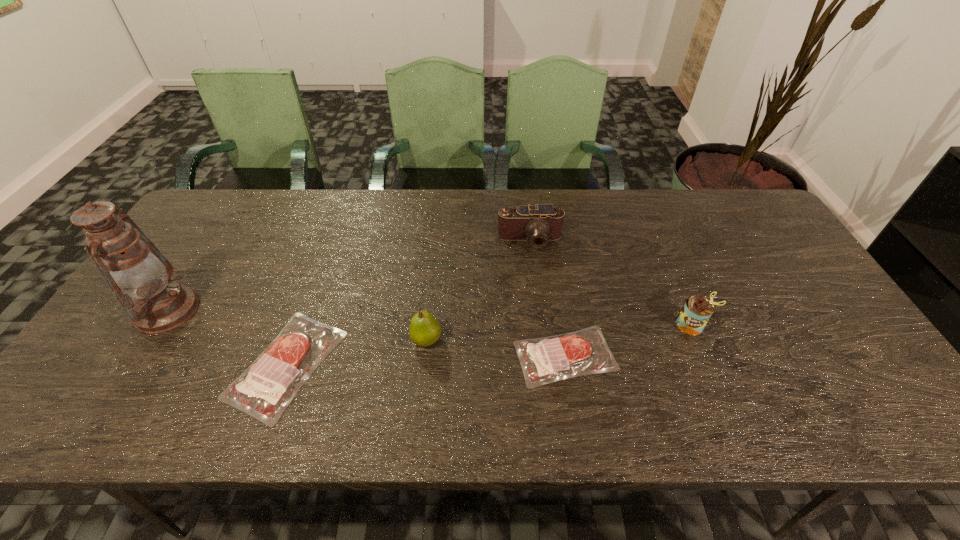
At what (x,y) coordinates should I click in order to perform the action: click on blank region between the fourth object from right to left and the camera. Please return your answer as a coordinate pair (x, y). The width and height of the screenshot is (960, 540). Looking at the image, I should click on (478, 291).

At what (x,y) coordinates should I click in order to perform the action: click on unoccupied position between the shorter steak and the pear. Please return your answer as a coordinate pair (x, y). Image resolution: width=960 pixels, height=540 pixels. Looking at the image, I should click on (495, 348).

Locate which object ranks third in proximity to the camera. Please provide its 2D coordinates. Your answer should be formatted as a tuple, i.e. [(x, y)], where the tuple contains the x and y coordinates of a point satisfying the conditions above.

[(697, 310)]

You are a GUI agent. You are given a task and a screenshot of the screen. Output one action in this format:
    pyautogui.click(x=<x>, y=<y>)
    Task: Click on the object identified as the closest to the tallest object
    This screenshot has width=960, height=540.
    Given the screenshot: What is the action you would take?
    pyautogui.click(x=264, y=390)

Locate an element on the screen. vacant area that satisfies the following two spatial constraints: 1. on the back side of the fifth object from right to left; 2. on the right side of the rightmost object is located at coordinates (300, 325).

You are a GUI agent. You are given a task and a screenshot of the screen. Output one action in this format:
    pyautogui.click(x=<x>, y=<y>)
    Task: Click on the free space that satisfies the following two spatial constraints: 1. on the back side of the fourth object from right to left; 2. on the left side of the second object from left to right
    
    Given the screenshot: What is the action you would take?
    pyautogui.click(x=295, y=340)

Identify the location of vacant region that satisfies the following two spatial constraints: 1. on the front-facing side of the rightmost object; 2. on the right side of the camera. The image size is (960, 540). (540, 325).

The height and width of the screenshot is (540, 960). I want to click on free space that satisfies the following two spatial constraints: 1. on the back side of the right steak; 2. on the right side of the fifth object from right to left, so click(x=289, y=356).

This screenshot has width=960, height=540. In order to click on free spot that satisfies the following two spatial constraints: 1. on the front-facing side of the can; 2. on the left side of the farthest object in this screenshot , I will do `click(540, 325)`.

The height and width of the screenshot is (540, 960). I want to click on free space that satisfies the following two spatial constraints: 1. on the front-facing side of the can; 2. on the right side of the camera, so click(540, 325).